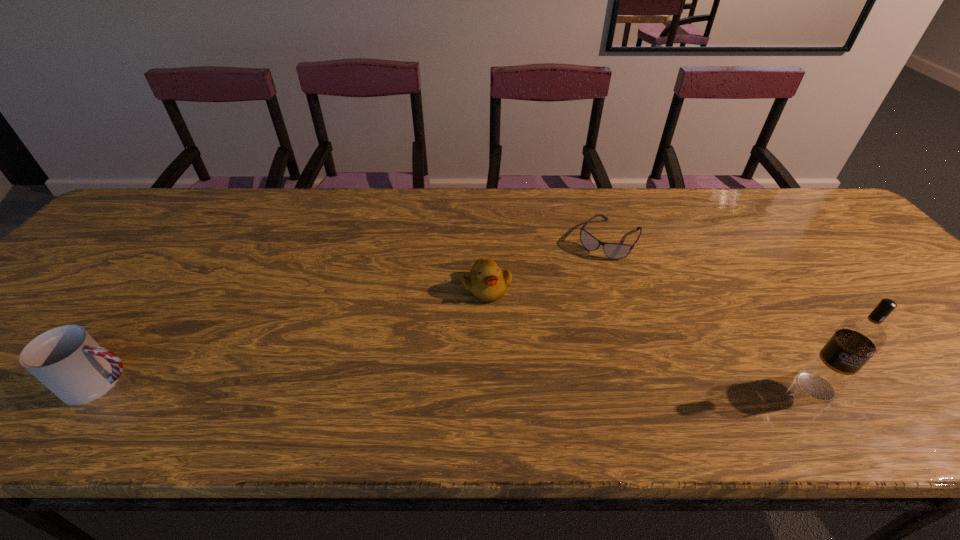
The width and height of the screenshot is (960, 540). I want to click on free space located on the front-facing side of the duckling, so click(522, 346).

Image resolution: width=960 pixels, height=540 pixels. Find the location of `free location located on the front-facing side of the duckling`. free location located on the front-facing side of the duckling is located at coordinates (520, 343).

Locate an element on the screen. Image resolution: width=960 pixels, height=540 pixels. free region located on the lenses of the third object from left to right is located at coordinates (568, 301).

The image size is (960, 540). Find the location of `vacant region located on the lenses of the third object from left to right`. vacant region located on the lenses of the third object from left to right is located at coordinates (563, 308).

In order to click on vacant space situated 0.090m on the lenses of the third object from left to right in this screenshot , I will do `click(585, 277)`.

The width and height of the screenshot is (960, 540). I want to click on object that is positioned at the far edge, so click(615, 251).

Find the location of a particular element. Image resolution: width=960 pixels, height=540 pixels. cup located at the near edge is located at coordinates (67, 360).

This screenshot has height=540, width=960. I want to click on vodka located in the near edge section of the desktop, so click(857, 339).

Identify the location of free location at the far edge of the desktop. pyautogui.click(x=551, y=221).

This screenshot has height=540, width=960. I want to click on vacant space at the near edge, so click(x=423, y=362).